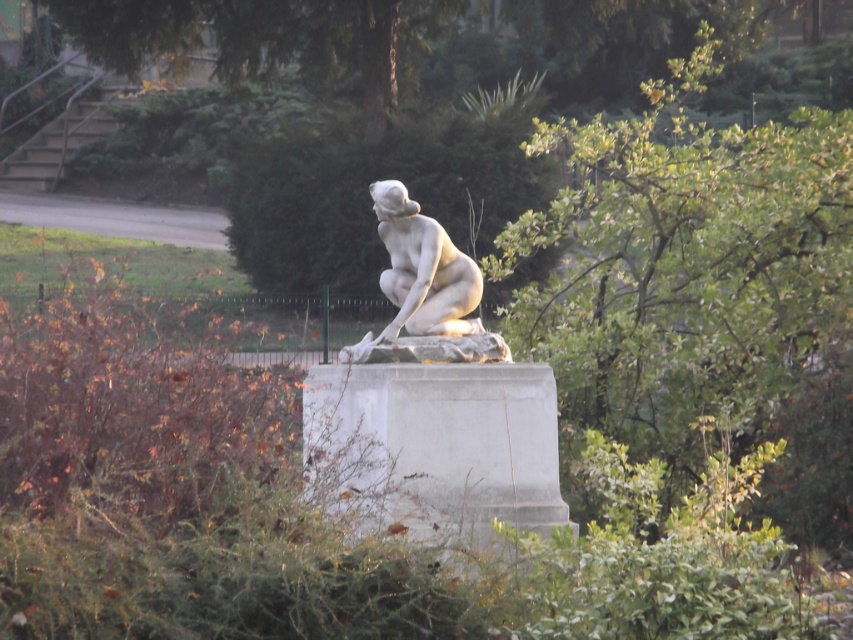
You are an art student trying to sketch the white marble statue at center but there is a green leafy tree at upper center blocking your view. Can you move to the right side to get a clear view of the statue?

The white marble statue at center is behind the green leafy tree at upper center, so moving to the right side might allow you to see around the tree and get a clearer view of the statue.

You are an art student standing in front of the white marble statue at center. You want to take a photo of the statue with the green leafy tree at upper center in the background. Which side of the statue should you stand to ensure the tree appears behind it?

You should stand to the right side of the white marble statue at center because the green leafy tree at upper center is positioned on the right side of the statue, so standing there will place the tree behind it in the photo.

You are an art student observing the classical statue in the scene. You notice the green leafy tree at upper center and the white marble statue at center. Which object is located above the other?

The green leafy tree at upper center is positioned over the white marble statue at center, meaning the tree is above the statue.